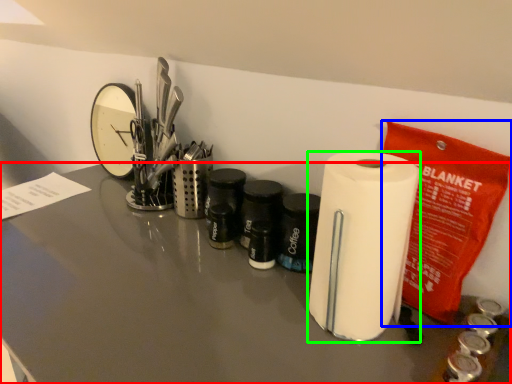
Question: Which object is the farthest from counter top (highlighted by a red box)? Choose among these: stationery (highlighted by a blue box) or paper towel (highlighted by a green box).

Choices:
 (A) stationery
 (B) paper towel

Answer: (A)